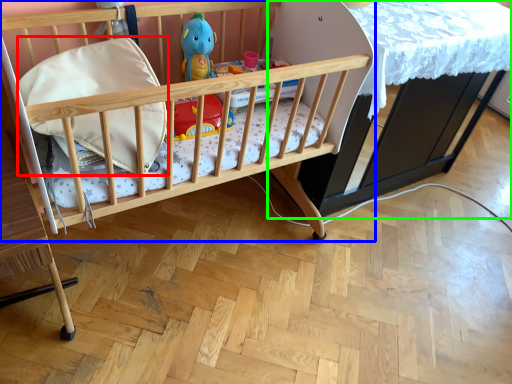
Question: Which object is positioned closest to pillow (highlighted by a red box)? Select from infant bed (highlighted by a blue box) and table (highlighted by a green box).

Choices:
 (A) infant bed
 (B) table

Answer: (A)